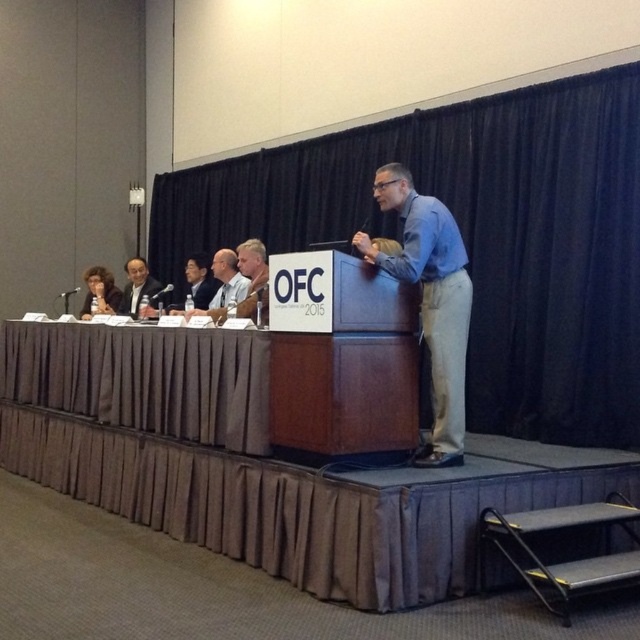
The image size is (640, 640). Describe the element at coordinates (145, 378) in the screenshot. I see `brown fabric table at lower left` at that location.

Which of these two, brown fabric table at lower left or blue shirt at center, stands shorter?

With less height is brown fabric table at lower left.

The height and width of the screenshot is (640, 640). Find the location of `brown fabric table at lower left`. brown fabric table at lower left is located at coordinates (145, 378).

Does light brown wood chair at center appear over matte black suit at center?

Indeed, light brown wood chair at center is positioned over matte black suit at center.

Does light brown wood chair at center have a greater width compared to matte black suit at center?

No, light brown wood chair at center is not wider than matte black suit at center.

Between point (257, 278) and point (140, 269), which one is positioned behind?

The point (140, 269) is more distant.

This screenshot has height=640, width=640. What are the coordinates of `light brown wood chair at center` in the screenshot? It's located at (253, 276).

Is point (220, 344) closer to camera compared to point (250, 284)?

Yes, it is.

Which is below, brown fabric table at lower left or light brown wood chair at center?

brown fabric table at lower left

Between point (221, 369) and point (259, 294), which one is positioned behind?

The point (259, 294) is more distant.

At what (x,y) coordinates should I click in order to perform the action: click on brown fabric table at lower left. Please return your answer as a coordinate pair (x, y). This screenshot has height=640, width=640. Looking at the image, I should click on click(x=145, y=378).